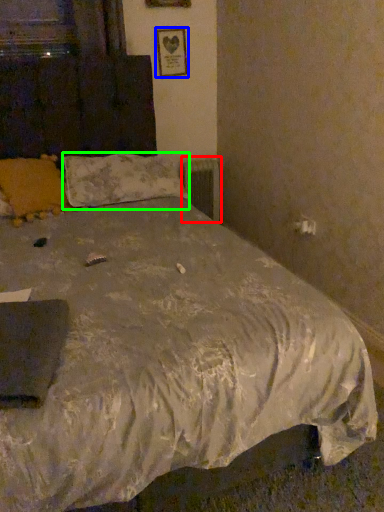
Question: Based on their relative distances, which object is nearer to radiator (highlighted by a red box)? Choose from picture frame (highlighted by a blue box) and pillow (highlighted by a green box).

Choices:
 (A) picture frame
 (B) pillow

Answer: (A)